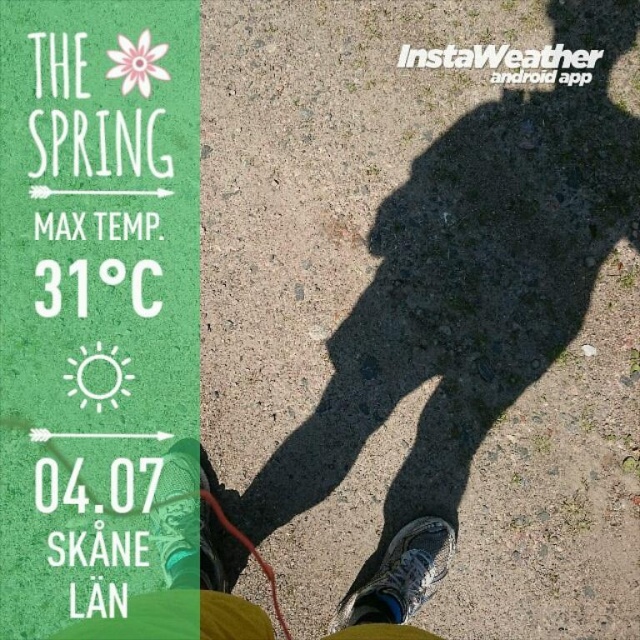
Question: Among these objects, which one is farthest from the camera?

Choices:
 (A) white mesh shoe at lower center
 (B) green fabric shoe at lower center

Answer: (B)

Question: Is gray fabric pants at lower center thinner than white mesh shoe at lower center?

Choices:
 (A) no
 (B) yes

Answer: (A)

Question: Does gray fabric pants at lower center lie behind white mesh shoe at lower center?

Choices:
 (A) yes
 (B) no

Answer: (B)

Question: Does gray fabric pants at lower center have a greater width compared to green fabric shoe at lower center?

Choices:
 (A) yes
 (B) no

Answer: (A)

Question: Which is farther from the gray fabric pants at lower center?

Choices:
 (A) green fabric shoe at lower center
 (B) white mesh shoe at lower center

Answer: (A)

Question: Which of these objects is positioned closest to the green fabric shoe at lower center?

Choices:
 (A) white mesh shoe at lower center
 (B) gray fabric pants at lower center

Answer: (B)